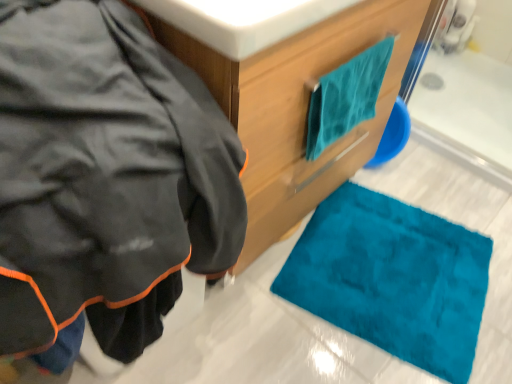
Question: Should I look upward or downward to see teal soft towel at upper right?

Choices:
 (A) down
 (B) up

Answer: (B)

Question: Does matte black jacket at left lie in front of teal soft towel at upper right?

Choices:
 (A) no
 (B) yes

Answer: (B)

Question: Is matte black jacket at left next to teal soft towel at upper right and touching it?

Choices:
 (A) no
 (B) yes

Answer: (A)

Question: Is matte black jacket at left wider than teal soft towel at upper right?

Choices:
 (A) yes
 (B) no

Answer: (A)

Question: From the image's perspective, would you say matte black jacket at left is positioned over teal soft towel at upper right?

Choices:
 (A) no
 (B) yes

Answer: (A)

Question: Is matte black jacket at left shorter than teal soft towel at upper right?

Choices:
 (A) no
 (B) yes

Answer: (A)

Question: From a real-world perspective, is matte black jacket at left over teal soft towel at upper right?

Choices:
 (A) no
 (B) yes

Answer: (A)

Question: Considering the relative sizes of matte black jacket at left and teal fabric towel at upper right in the image provided, is matte black jacket at left taller than teal fabric towel at upper right?

Choices:
 (A) yes
 (B) no

Answer: (B)

Question: Does matte black jacket at left appear on the right side of teal fabric towel at upper right?

Choices:
 (A) yes
 (B) no

Answer: (B)

Question: Is teal fabric towel at upper right surrounded by matte black jacket at left?

Choices:
 (A) yes
 (B) no

Answer: (B)

Question: Does matte black jacket at left lie behind teal fabric towel at upper right?

Choices:
 (A) no
 (B) yes

Answer: (A)

Question: Considering the relative sizes of matte black jacket at left and teal fabric towel at upper right in the image provided, is matte black jacket at left smaller than teal fabric towel at upper right?

Choices:
 (A) no
 (B) yes

Answer: (B)

Question: From a real-world perspective, is matte black jacket at left physically below teal fabric towel at upper right?

Choices:
 (A) yes
 (B) no

Answer: (B)

Question: From a real-world perspective, is white glossy sink at upper center beneath matte black jacket at left?

Choices:
 (A) yes
 (B) no

Answer: (B)